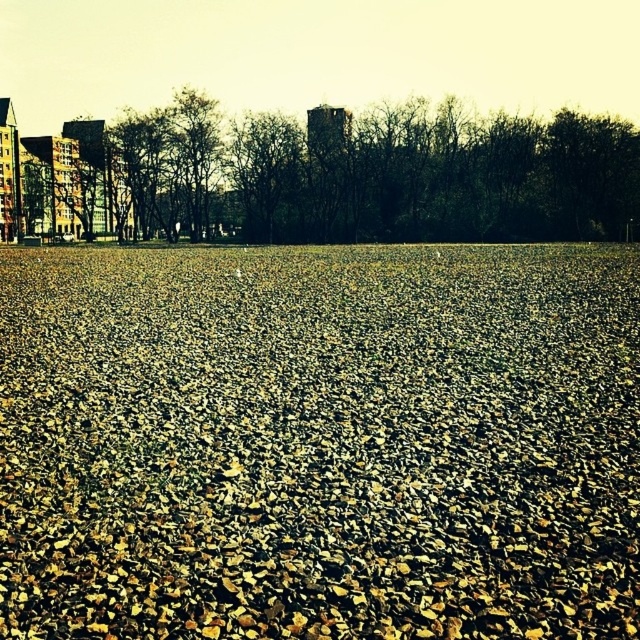
Question: Is brown gravel at center to the right of brown leafless tree at center from the viewer's perspective?

Choices:
 (A) yes
 (B) no

Answer: (A)

Question: Is the position of brown gravel at center less distant than that of brown leafless tree at center?

Choices:
 (A) yes
 (B) no

Answer: (A)

Question: Does brown gravel at center appear on the right side of brown leafless tree at center?

Choices:
 (A) no
 (B) yes

Answer: (B)

Question: Which point is closer to the camera?

Choices:
 (A) brown gravel at center
 (B) brown leafless tree at center

Answer: (A)